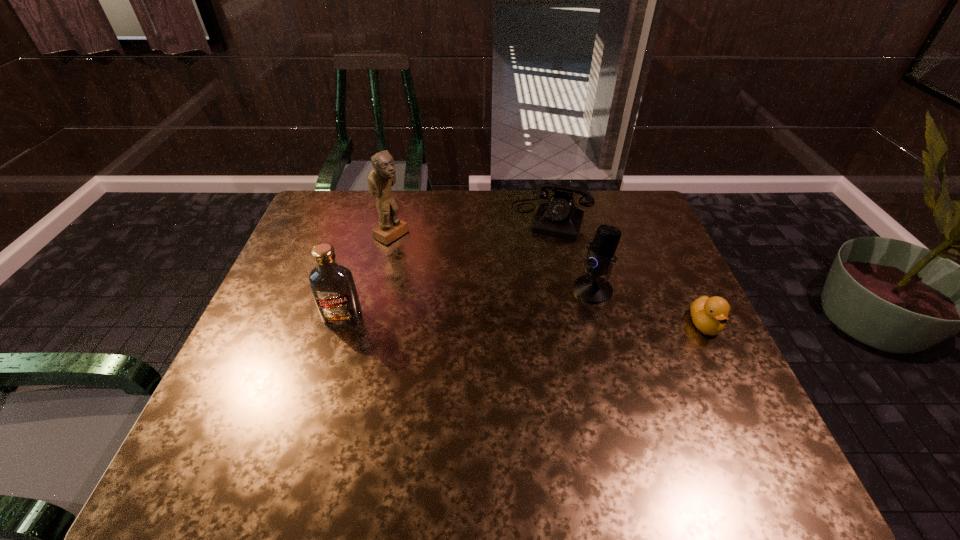
The height and width of the screenshot is (540, 960). I want to click on vodka, so coord(333,287).

This screenshot has height=540, width=960. What are the coordinates of `the rightmost object` in the screenshot? It's located at (709, 315).

Where is `telephone`? The height and width of the screenshot is (540, 960). telephone is located at coordinates pos(559,217).

You are a GUI agent. You are given a task and a screenshot of the screen. Output one action in this format:
    pyautogui.click(x=<x>, y=<y>)
    Task: Click on the figurine
    The width and height of the screenshot is (960, 540).
    Given the screenshot: What is the action you would take?
    pyautogui.click(x=382, y=176)

Identify the location of the third nearest object. The width and height of the screenshot is (960, 540). (591, 288).

Image resolution: width=960 pixels, height=540 pixels. What are the coordinates of `vacant space located on the front-facing side of the vodka` in the screenshot? It's located at (311, 423).

Image resolution: width=960 pixels, height=540 pixels. I want to click on free region located 0.160m on the face of the rightmost object, so click(742, 401).

This screenshot has height=540, width=960. I want to click on vacant region located on the front face of the telephone, so click(529, 277).

Find the location of `vacant space located on the front face of the telephone`. vacant space located on the front face of the telephone is located at coordinates (533, 266).

This screenshot has height=540, width=960. In order to click on vacant space situated on the front face of the telephone in this screenshot , I will do `click(522, 294)`.